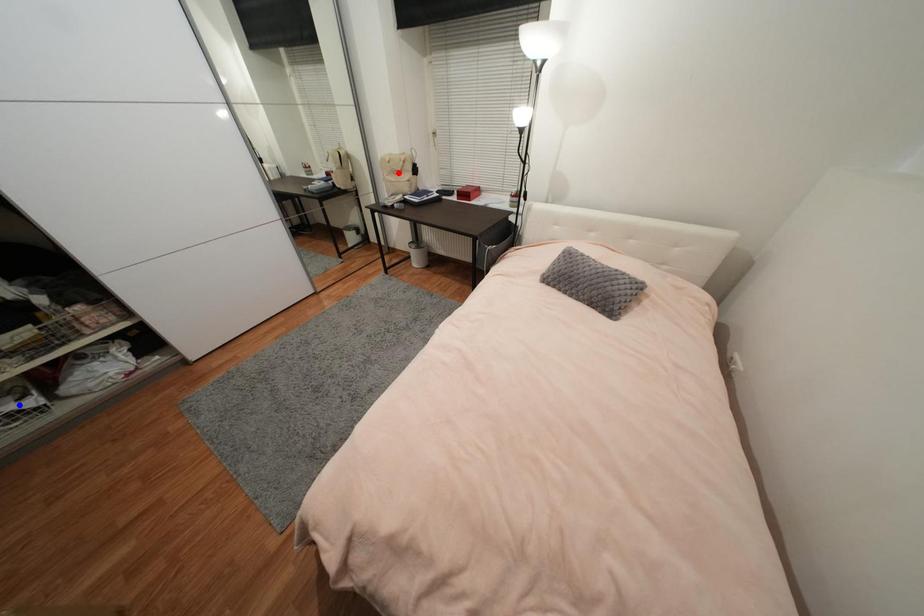
Question: Which of the two points in the image is closer to the camera?

Choices:
 (A) Blue point is closer.
 (B) Red point is closer.

Answer: (A)